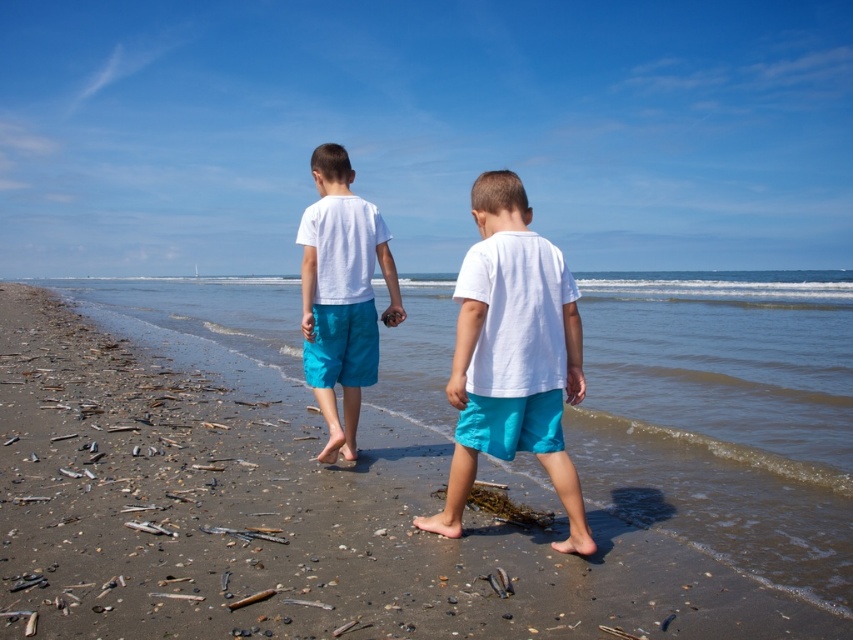
Question: Can you confirm if smooth sand at center is thinner than white matte shorts at center?

Choices:
 (A) yes
 (B) no

Answer: (B)

Question: Which object appears closest to the camera in this image?

Choices:
 (A) matte white t-shirt at center
 (B) white matte shorts at center
 (C) smooth sand at center

Answer: (C)

Question: Does matte white t-shirt at center have a smaller size compared to white matte shorts at center?

Choices:
 (A) yes
 (B) no

Answer: (B)

Question: Is smooth sand at center wider than matte white t-shirt at center?

Choices:
 (A) yes
 (B) no

Answer: (A)

Question: Which object is the farthest from the matte white t-shirt at center?

Choices:
 (A) white matte shorts at center
 (B) smooth sand at center

Answer: (B)

Question: Which point is farther to the camera?

Choices:
 (A) (138, 611)
 (B) (315, 300)
 (C) (566, 484)

Answer: (B)